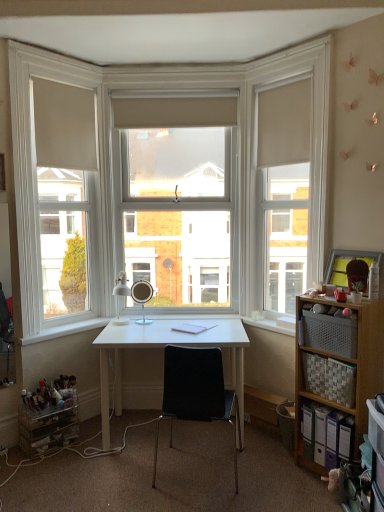
The width and height of the screenshot is (384, 512). Find the location of `empty space that is ontop of white glossy desk at center (from a real-world perspective)`. empty space that is ontop of white glossy desk at center (from a real-world perspective) is located at coordinates (164, 328).